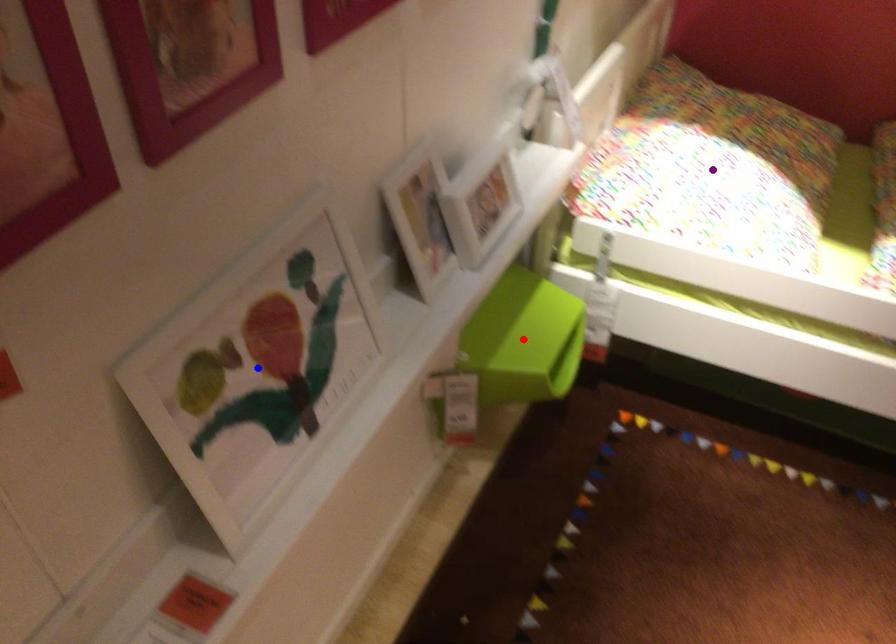
Order these from nearest to farthest:
purple point | blue point | red point

1. purple point
2. red point
3. blue point